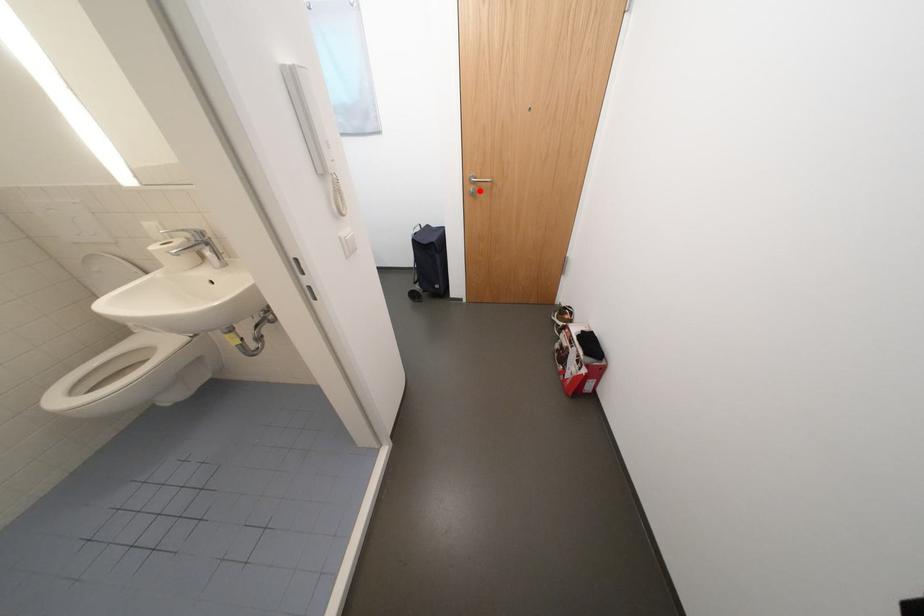
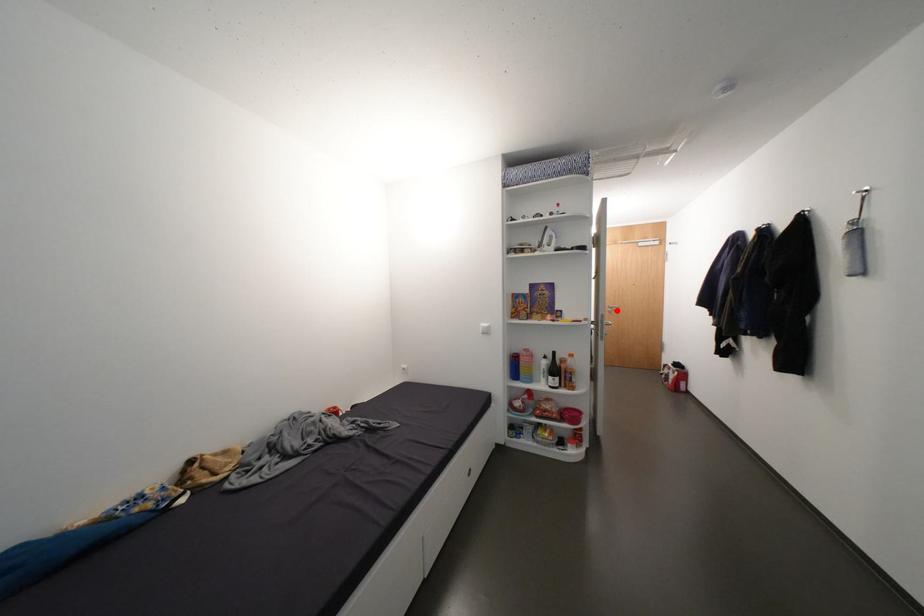
I am providing you with two images of the same scene from different viewpoints. A red point is marked on the first image and another point is marked on the second image. Do the highlighted points in image1 and image2 indicate the same real-world spot?

Yes